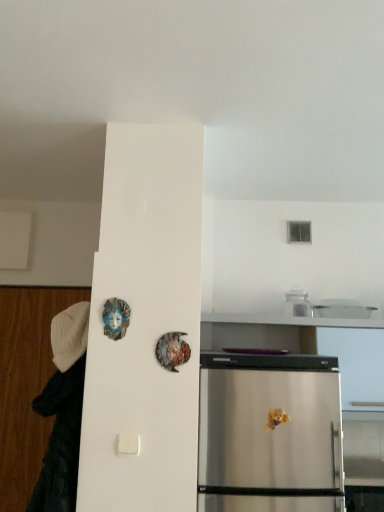
Question: Should I look upward or downward to see white fabric at left?

Choices:
 (A) up
 (B) down

Answer: (B)

Question: Considering the relative positions of shiny metallic mask at center and white fabric at left in the image provided, is shiny metallic mask at center to the right of white fabric at left from the viewer's perspective?

Choices:
 (A) yes
 (B) no

Answer: (A)

Question: Does shiny metallic mask at center have a greater width compared to white fabric at left?

Choices:
 (A) yes
 (B) no

Answer: (B)

Question: Is shiny metallic mask at center bigger than white fabric at left?

Choices:
 (A) yes
 (B) no

Answer: (B)

Question: Can you confirm if shiny metallic mask at center is smaller than white fabric at left?

Choices:
 (A) no
 (B) yes

Answer: (B)

Question: Is shiny metallic mask at center further to the viewer compared to white fabric at left?

Choices:
 (A) no
 (B) yes

Answer: (A)

Question: From a real-world perspective, does shiny metallic mask at center sit lower than white fabric at left?

Choices:
 (A) no
 (B) yes

Answer: (A)

Question: Could you tell me if white fabric at left is facing shiny metallic mask at center?

Choices:
 (A) yes
 (B) no

Answer: (B)

Question: Can you confirm if white fabric at left is positioned to the right of shiny metallic mask at center?

Choices:
 (A) no
 (B) yes

Answer: (A)

Question: From the image's perspective, is white fabric at left under shiny metallic mask at center?

Choices:
 (A) no
 (B) yes

Answer: (B)

Question: Is white fabric at left taller than shiny metallic mask at center?

Choices:
 (A) no
 (B) yes

Answer: (B)

Question: Is white fabric at left positioned before shiny metallic mask at center?

Choices:
 (A) no
 (B) yes

Answer: (A)

Question: Considering the relative positions of white fabric at left and shiny metallic mask at center in the image provided, is white fabric at left to the left of shiny metallic mask at center from the viewer's perspective?

Choices:
 (A) no
 (B) yes

Answer: (B)

Question: From the image's perspective, is shiny metallic mask at center positioned above or below white fabric at left?

Choices:
 (A) below
 (B) above

Answer: (B)